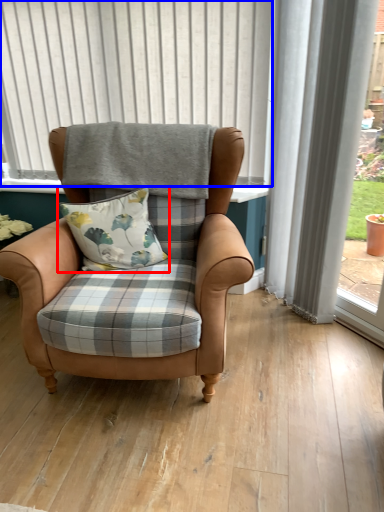
Question: Among these objects, which one is nearest to the camera, pillow (highlighted by a red box) or bay window (highlighted by a blue box)?

Choices:
 (A) pillow
 (B) bay window

Answer: (A)